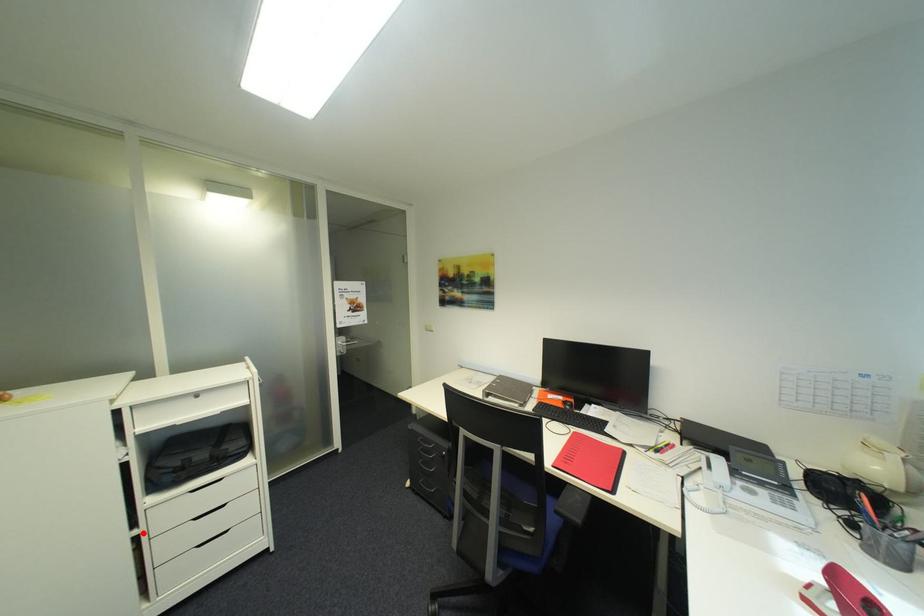
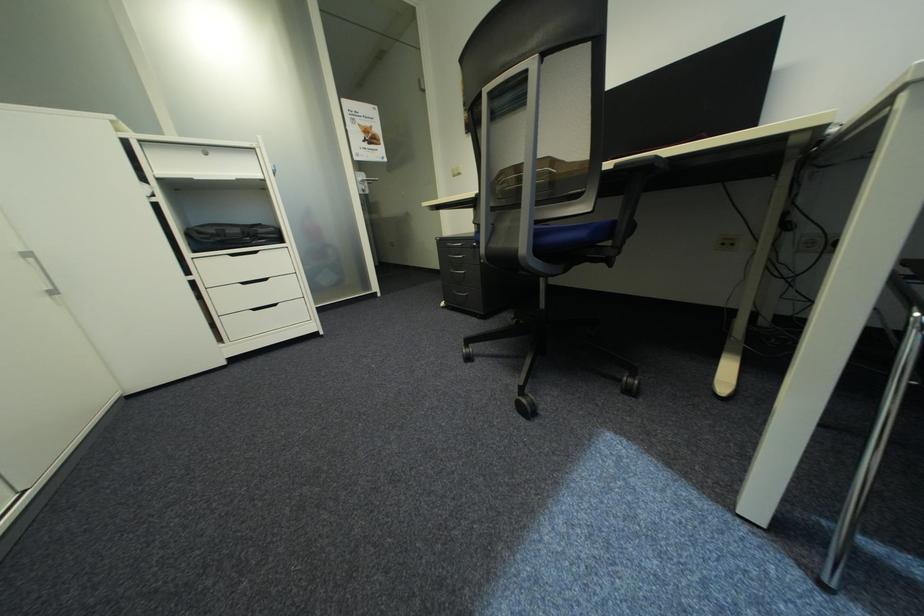
The point at the highlighted location is marked in the first image. Where is the corresponding point in the second image?

(199, 278)